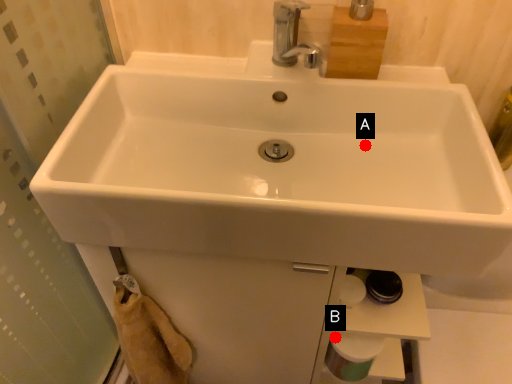
Question: Two points are circled on the image, labeled by A and B beside each circle. Which point is closer to the camera?

Choices:
 (A) A is closer
 (B) B is closer

Answer: (A)